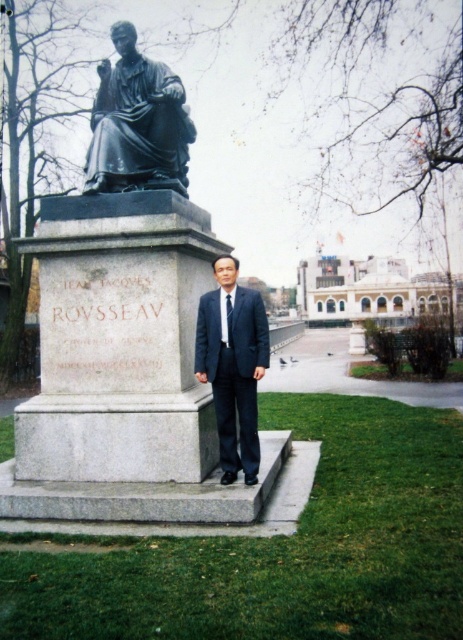
Between point (235, 349) and point (227, 339), which one is positioned in front?

Point (235, 349) is in front.

Describe the element at coordinates (232, 365) in the screenshot. I see `dark blue suit at center` at that location.

Is point (214, 392) closer to camera compared to point (225, 317)?

No, it is not.

At what (x,y) coordinates should I click in order to perform the action: click on dark blue suit at center. Please return your answer as a coordinate pair (x, y). This screenshot has width=463, height=640. Looking at the image, I should click on (232, 365).

How much distance is there between bronze statue at center and dark blue suit at center?

bronze statue at center and dark blue suit at center are 2.01 meters apart from each other.

Is point (131, 180) farther from camera compared to point (236, 264)?

Yes, point (131, 180) is farther from viewer.

Locate an element on the screen. The image size is (463, 640). bronze statue at center is located at coordinates (137, 124).

Does bronze statue at center have a lesser width compared to blue silk tie at center?

Incorrect, bronze statue at center's width is not less than blue silk tie at center's.

Can you confirm if bronze statue at center is bigger than blue silk tie at center?

Correct, bronze statue at center is larger in size than blue silk tie at center.

Does point (111, 177) come behind point (227, 326)?

Yes, it is behind point (227, 326).

You are a GUI agent. You are given a task and a screenshot of the screen. Output one action in this format:
    pyautogui.click(x=<x>, y=<y>)
    Task: Click on the bronze statue at center
    The height and width of the screenshot is (640, 463).
    Given the screenshot: What is the action you would take?
    pyautogui.click(x=137, y=124)